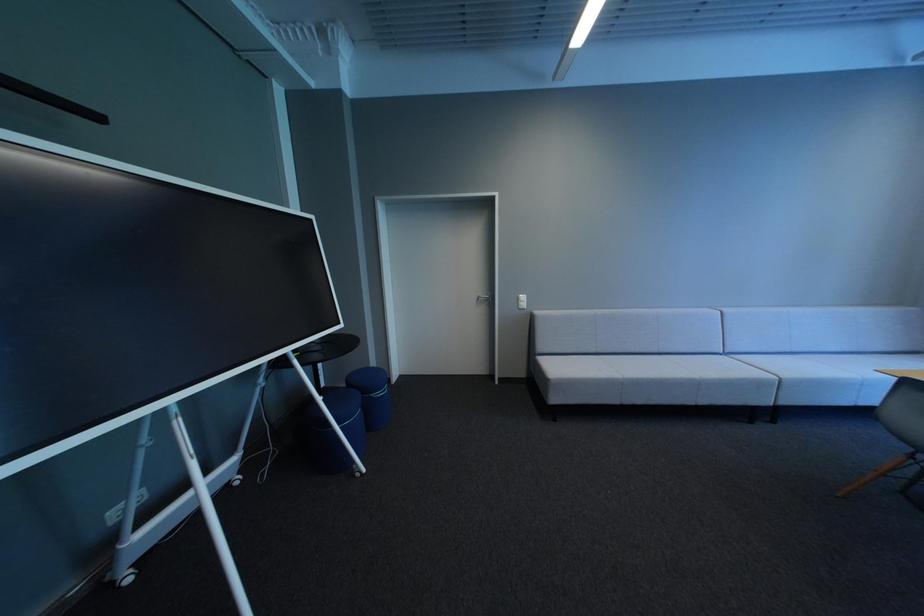
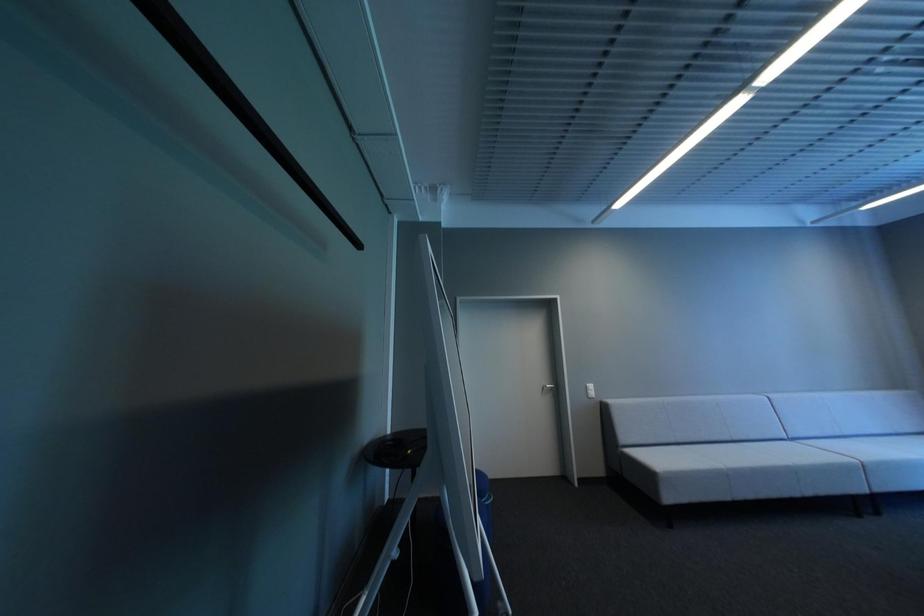
Question: In a continuous first-person perspective shot, in which direction is the camera moving?

Choices:
 (A) Left
 (B) Right
 (C) Forward
 (D) Backward

Answer: (A)